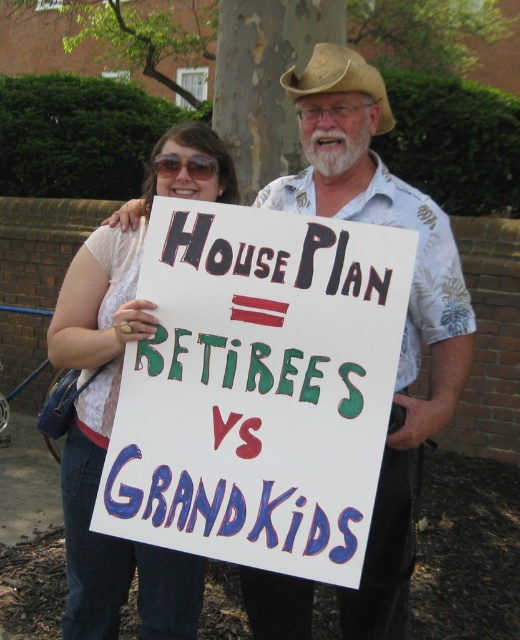
Question: Estimate the real-world distances between objects in this image. Which object is farther from the white paper sign at center?

Choices:
 (A) white floral shirt at center
 (B) tan straw cowboy hat at upper center

Answer: (B)

Question: Based on their relative distances, which object is farther from the tan straw cowboy hat at upper center?

Choices:
 (A) white lace shirt at upper left
 (B) white floral shirt at center

Answer: (A)

Question: Is white floral shirt at center to the left of white lace shirt at upper left from the viewer's perspective?

Choices:
 (A) no
 (B) yes

Answer: (A)

Question: Which object is positioned closest to the white floral shirt at center?

Choices:
 (A) tan straw cowboy hat at upper center
 (B) white paper sign at center

Answer: (B)

Question: Does white lace shirt at upper left appear on the left side of tan straw cowboy hat at upper center?

Choices:
 (A) yes
 (B) no

Answer: (A)

Question: Is white lace shirt at upper left above tan straw cowboy hat at upper center?

Choices:
 (A) no
 (B) yes

Answer: (A)